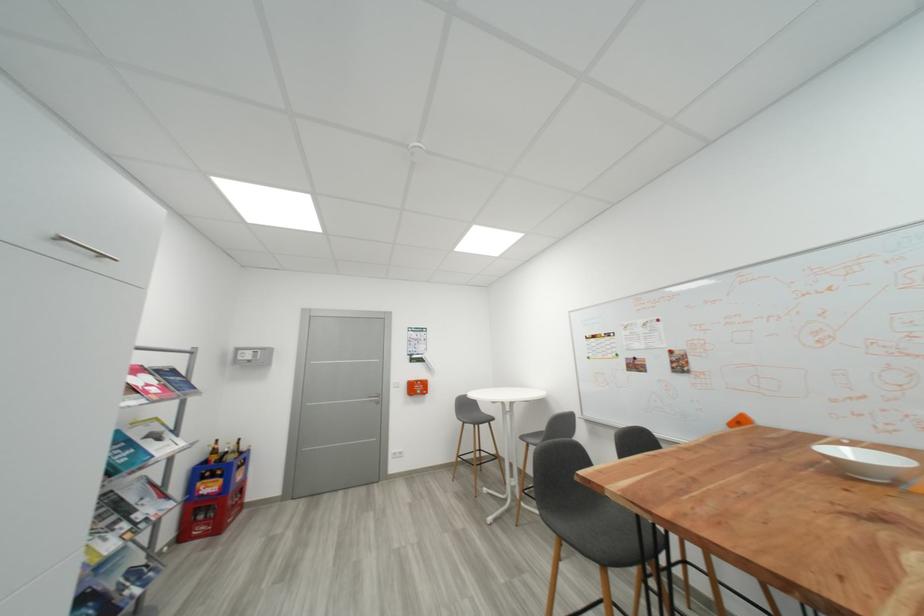
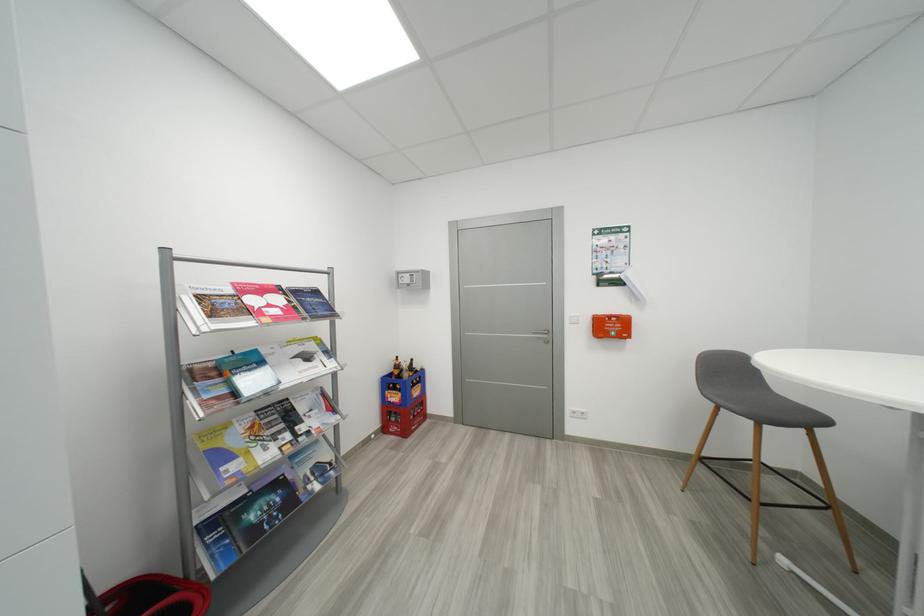
Find the pixel in the second image that matches [223,454] in the first image.

(404, 369)